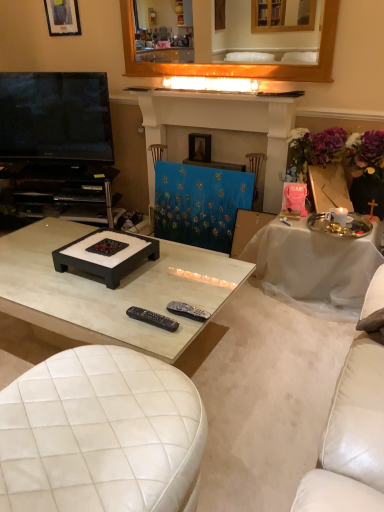
The image size is (384, 512). What do you see at coordinates (235, 92) in the screenshot?
I see `white marble fireplace at upper center` at bounding box center [235, 92].

I want to click on white marble fireplace at upper center, so click(x=235, y=92).

Describe the element at coordinates (61, 190) in the screenshot. I see `black plastic entertainment center at left` at that location.

Measure the distance between white glossy coffee table at center and camera.

The distance of white glossy coffee table at center from camera is 1.51 meters.

Image resolution: width=384 pixels, height=512 pixels. Find the location of `white marble fireplace at upper center`. white marble fireplace at upper center is located at coordinates [235, 92].

In the scene shown: From the image's perspective, is black plastic remote control at center, which ranks as the second remote control in right-to-left order, under wooden mirror at upper center?

Yes.

Is black plastic remote control at center, which is counted as the first remote control, starting from the left, thinner than wooden mirror at upper center?

Indeed, black plastic remote control at center, which is counted as the first remote control, starting from the left, has a lesser width compared to wooden mirror at upper center.

In the scene shown: Which of these two, black plastic remote control at center, which is counted as the first remote control, starting from the left, or wooden mirror at upper center, stands shorter?

black plastic remote control at center, which is counted as the first remote control, starting from the left, is shorter.

Is black plastic remote control at center, which ranks as the second remote control in right-to-left order, facing away from wooden mirror at upper center?

No, black plastic remote control at center, which ranks as the second remote control in right-to-left order, is not facing the opposite direction of wooden mirror at upper center.

Are white marble fireplace at upper center and wooden picture frame at center, positioned as the 1th picture frame in bottom-to-top order, making contact?

white marble fireplace at upper center is not next to wooden picture frame at center, positioned as the 1th picture frame in bottom-to-top order, and they're not touching.

From a real-world perspective, is white marble fireplace at upper center located beneath wooden picture frame at center, the second picture frame positioned from the top?

No, from a real-world perspective, white marble fireplace at upper center is not under wooden picture frame at center, the second picture frame positioned from the top.

Can you tell me how much white marble fireplace at upper center and wooden picture frame at center, which is counted as the 2th picture frame, starting from the left, differ in facing direction?

There is a 0.000893-degree angle between the facing directions of white marble fireplace at upper center and wooden picture frame at center, which is counted as the 2th picture frame, starting from the left.

Who is smaller, white marble fireplace at upper center or wooden picture frame at center, positioned as the 1th picture frame in bottom-to-top order?

wooden picture frame at center, positioned as the 1th picture frame in bottom-to-top order.

Considering the relative sizes of wooden mirror at upper center and black plastic remote at center, the second remote control from the left, in the image provided, is wooden mirror at upper center shorter than black plastic remote at center, the second remote control from the left,?

Incorrect, the height of wooden mirror at upper center does not fall short of that of black plastic remote at center, the second remote control from the left.

Between wooden mirror at upper center and black plastic remote at center, marked as the 1th remote control in a right-to-left arrangement, which one has larger size?

With larger size is wooden mirror at upper center.

Is wooden mirror at upper center facing towards black plastic remote at center, marked as the 1th remote control in a right-to-left arrangement?

No, wooden mirror at upper center does not turn towards black plastic remote at center, marked as the 1th remote control in a right-to-left arrangement.

Where is `mirror above the black plastic remote at center, marked as the 1th remote control in a right-to-left arrangement (from a real-world perspective)`? The height and width of the screenshot is (512, 384). mirror above the black plastic remote at center, marked as the 1th remote control in a right-to-left arrangement (from a real-world perspective) is located at coordinates (234, 64).

Which is closer, (186, 316) or (286, 228)?

Point (186, 316) is closer to the camera than point (286, 228).

From the image's perspective, which one is positioned lower, black plastic remote at center, the second remote control from the left, or shiny silver tray at upper right?

black plastic remote at center, the second remote control from the left, is shown below in the image.

Is black plastic remote at center, marked as the 1th remote control in a right-to-left arrangement, facing away from shiny silver tray at upper right?

Yes.

Which of these two, black plastic remote at center, marked as the 1th remote control in a right-to-left arrangement, or shiny silver tray at upper right, is wider?

shiny silver tray at upper right.

Which object is closer to the camera, shiny silver tray at upper right or wooden mirror at upper center?

Positioned in front is shiny silver tray at upper right.

Looking at their sizes, would you say shiny silver tray at upper right is wider or thinner than wooden mirror at upper center?

shiny silver tray at upper right is wider than wooden mirror at upper center.

Is shiny silver tray at upper right bigger or smaller than wooden mirror at upper center?

In the image, shiny silver tray at upper right appears to be larger than wooden mirror at upper center.

Identify the location of table beneath the wooden mirror at upper center (from a real-world perspective). This screenshot has width=384, height=512. (313, 268).

Consider the image. From a real-world perspective, relative to white glossy coffee table at center, is matte black picture frame at upper left, the first picture frame from the top, vertically above or below?

matte black picture frame at upper left, the first picture frame from the top, is situated higher than white glossy coffee table at center in the real world.

In terms of height, does matte black picture frame at upper left, the second picture frame viewed from the right, look taller or shorter compared to white glossy coffee table at center?

In the image, matte black picture frame at upper left, the second picture frame viewed from the right, appears to be shorter than white glossy coffee table at center.

From the image's perspective, between matte black picture frame at upper left, the 1th picture frame in the left-to-right sequence, and white glossy coffee table at center, which one is located above?

matte black picture frame at upper left, the 1th picture frame in the left-to-right sequence, from the image's perspective.

Is matte black picture frame at upper left, the first picture frame from the top, positioned with its back to white glossy coffee table at center?

matte black picture frame at upper left, the first picture frame from the top, is not turned away from white glossy coffee table at center.

Between wooden picture frame at center, the second picture frame positioned from the top, and black plastic entertainment center at left, which one appears on the right side from the viewer's perspective?

Positioned to the right is wooden picture frame at center, the second picture frame positioned from the top.

Is wooden picture frame at center, marked as the 1th picture frame in a right-to-left arrangement, inside the boundaries of black plastic entertainment center at left, or outside?

wooden picture frame at center, marked as the 1th picture frame in a right-to-left arrangement, cannot be found inside black plastic entertainment center at left.

From a real-world perspective, starting from the black plastic entertainment center at left, which picture frame is the 1st one vertically above it? Please provide its 2D coordinates.

[(199, 147)]

From the image's perspective, does wooden picture frame at center, which is counted as the 2th picture frame, starting from the left, appear higher than black plastic entertainment center at left?

Indeed, from the image's perspective, wooden picture frame at center, which is counted as the 2th picture frame, starting from the left, is shown above black plastic entertainment center at left.

At what (x,y) coordinates should I click in order to perform the action: click on remote control that is the 1st object directly below the wooden mirror at upper center (from a real-world perspective). Please return your answer as a coordinate pair (x, y). Looking at the image, I should click on (152, 318).

I want to click on mantle in front of the wooden picture frame at center, the second picture frame positioned from the top, so click(x=235, y=92).

From the image, which object appears to be nearer to wooden mirror at upper center, white leather ottoman at lower left or matte black picture frame at upper left, the second picture frame viewed from the right?

matte black picture frame at upper left, the second picture frame viewed from the right, is closer to wooden mirror at upper center.

Considering their positions, is wooden picture frame at center, the second picture frame positioned from the top, positioned closer to white glossy coffee table at center than black plastic remote at center, the second remote control from the left?

Among the two, black plastic remote at center, the second remote control from the left, is located nearer to white glossy coffee table at center.

Considering their positions, is black plastic remote at center, marked as the 1th remote control in a right-to-left arrangement, positioned further to matte black picture frame at upper left, the first picture frame from the top, than white glossy coffee table at center?

black plastic remote at center, marked as the 1th remote control in a right-to-left arrangement, is positioned further to the anchor matte black picture frame at upper left, the first picture frame from the top.

Considering their positions, is white marble fireplace at upper center positioned further to white leather ottoman at lower left than shiny silver tray at upper right?

white marble fireplace at upper center is further to white leather ottoman at lower left.

Looking at the image, which one is located closer to white leather ottoman at lower left, wooden mirror at upper center or matte black picture frame at upper left, the second picture frame viewed from the right?

wooden mirror at upper center lies closer to white leather ottoman at lower left than the other object.

In the scene shown: Considering their positions, is black plastic remote control at center, which ranks as the second remote control in right-to-left order, positioned further to wooden picture frame at center, the second picture frame positioned from the top, than black plastic entertainment center at left?

The object further to wooden picture frame at center, the second picture frame positioned from the top, is black plastic remote control at center, which ranks as the second remote control in right-to-left order.

Based on their spatial positions, is wooden picture frame at center, the second picture frame positioned from the top, or black plastic entertainment center at left closer to white marble fireplace at upper center?

Based on the image, wooden picture frame at center, the second picture frame positioned from the top, appears to be nearer to white marble fireplace at upper center.

Estimate the real-world distances between objects in this image. Which object is closer to black plastic remote control at center, which is counted as the first remote control, starting from the left, white leather ottoman at lower left or blue fabric painting at center?

white leather ottoman at lower left is positioned closer to the anchor black plastic remote control at center, which is counted as the first remote control, starting from the left.

The height and width of the screenshot is (512, 384). Identify the location of picture frame between matte black picture frame at upper left, which is counted as the second picture frame, starting from the bottom, and blue fabric painting at center vertically. (199, 147).

Where is `curtain between white marble fireplace at upper center and shiny silver tray at upper right in the vertical direction`? The width and height of the screenshot is (384, 512). curtain between white marble fireplace at upper center and shiny silver tray at upper right in the vertical direction is located at coordinates (199, 204).

Locate an element on the screen. Image resolution: width=384 pixels, height=512 pixels. fireplace between white leather ottoman at lower left and wooden picture frame at center, marked as the 1th picture frame in a right-to-left arrangement, from front to back is located at coordinates (220, 127).

Identify the location of mirror between flat screen tv at left and shiny silver tray at upper right in the horizontal direction. (234, 64).